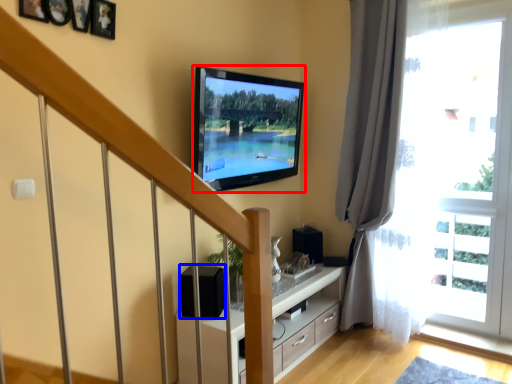
Question: Which of the following is the closest to the observer, television (highlighted by a red box) or speaker (highlighted by a blue box)?

Choices:
 (A) television
 (B) speaker

Answer: (A)